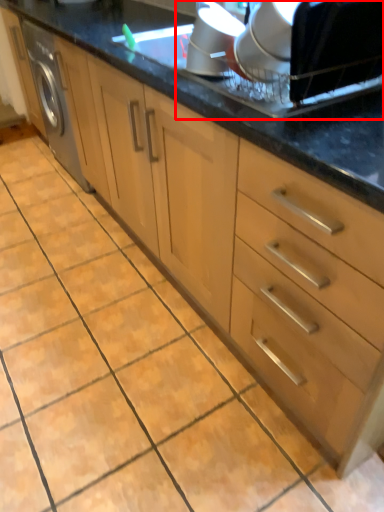
Question: Considering the relative positions of appliance (annotated by the red box) and appliance in the image provided, where is appliance (annotated by the red box) located with respect to the staircase?

Choices:
 (A) right
 (B) left

Answer: (A)